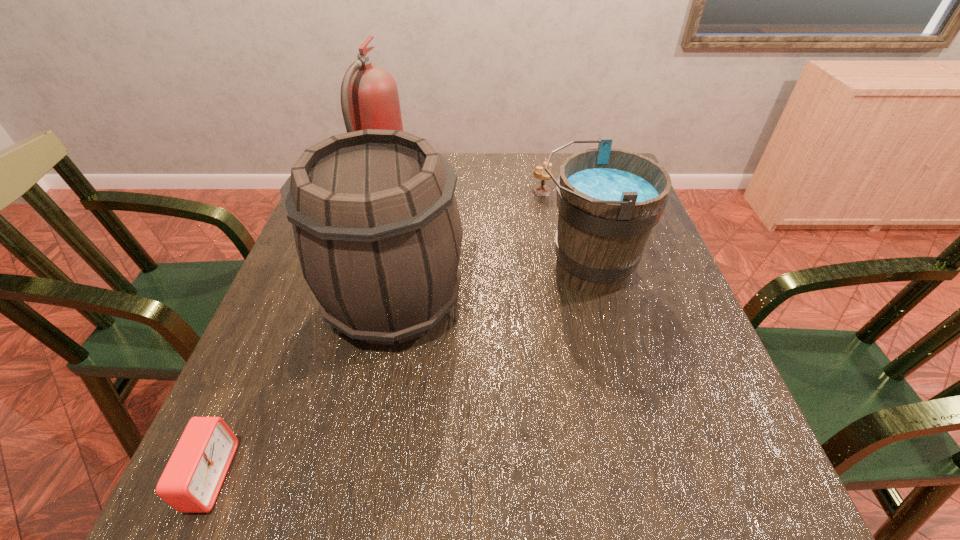
The width and height of the screenshot is (960, 540). In order to click on fire extinguisher in this screenshot , I will do `click(369, 96)`.

The height and width of the screenshot is (540, 960). What are the coordinates of `the left wine bucket` in the screenshot? It's located at (378, 234).

You are a GUI agent. You are given a task and a screenshot of the screen. Output one action in this format:
    pyautogui.click(x=<x>, y=<y>)
    Task: Click on the right wine bucket
    
    Given the screenshot: What is the action you would take?
    pyautogui.click(x=609, y=200)

Find the location of a particular element. The height and width of the screenshot is (540, 960). the shorter wine bucket is located at coordinates (609, 200).

This screenshot has height=540, width=960. What are the coordinates of `the fourth tallest object` in the screenshot? It's located at (541, 190).

The width and height of the screenshot is (960, 540). What are the coordinates of `the leftmost object` in the screenshot? It's located at (190, 483).

This screenshot has height=540, width=960. Find the location of `the shortest object`. the shortest object is located at coordinates (190, 483).

At what (x,y) coordinates should I click in order to perform the action: click on free space located 0.150m at the nozzle of the fire extinguisher. Please return your answer as a coordinate pair (x, y). Looking at the image, I should click on (462, 188).

Locate an element on the screen. vacant space located 0.290m on the right of the taller wine bucket is located at coordinates (600, 302).

Find the location of `vacant space located 0.350m with a handle on the side of the third tallest object`. vacant space located 0.350m with a handle on the side of the third tallest object is located at coordinates (382, 268).